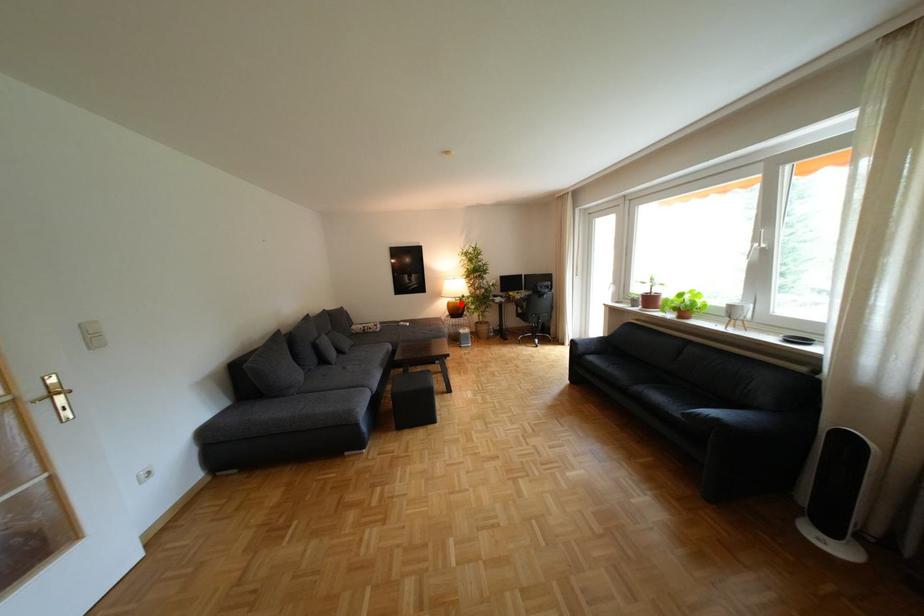
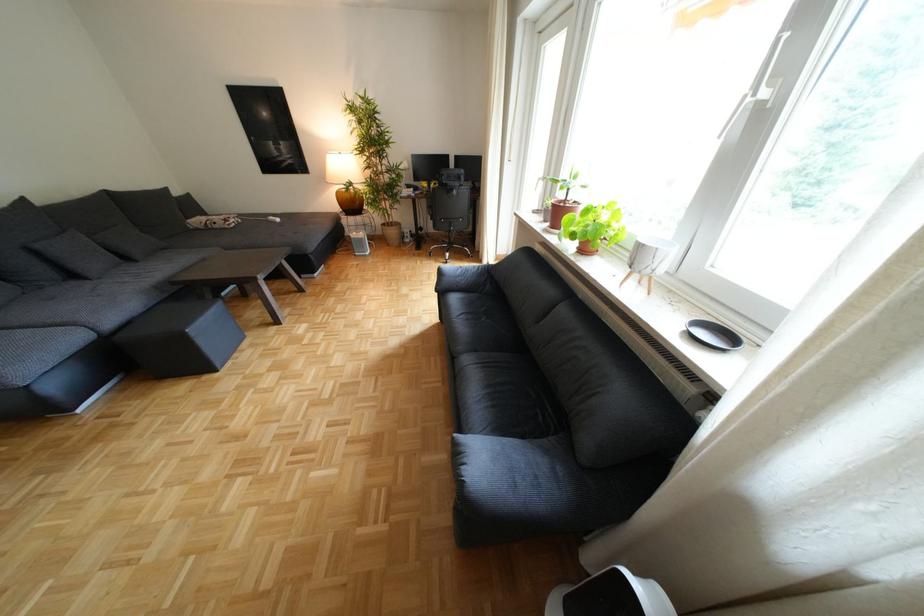
Question: A red point is marked in image1. In image2, is the corresponding 3D point closer to the camera or farther? Reply with the corresponding letter.

Choices:
 (A) The corresponding 3D point is closer.
 (B) The corresponding 3D point is farther.

Answer: (A)